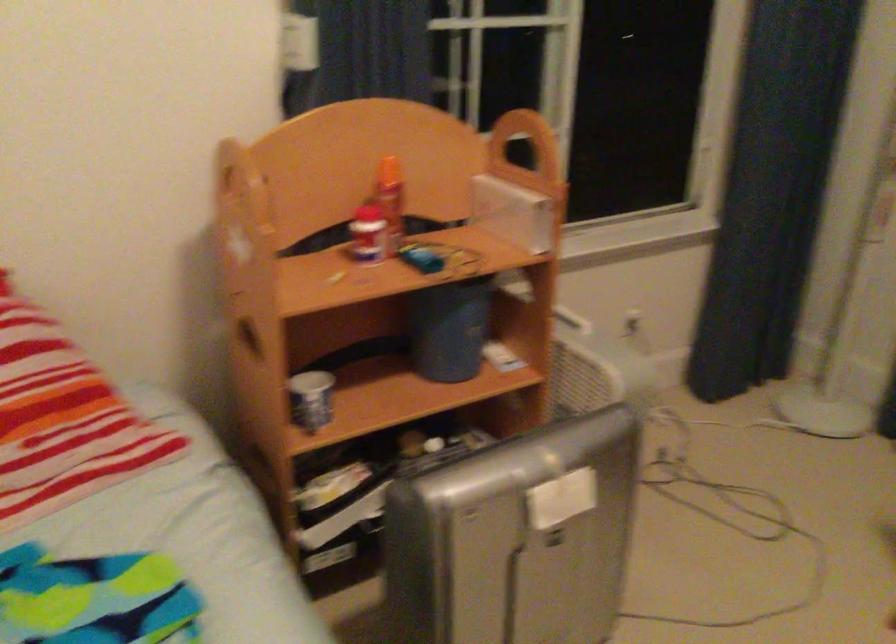
Find where to lift the blue bucket. Please return your answer as a coordinate pair (x, y).

(449, 328)